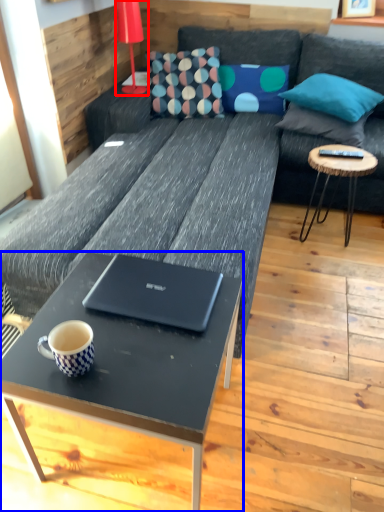
Question: Which object is further to the camera taking this photo, lamp (highlighted by a red box) or coffee table (highlighted by a blue box)?

Choices:
 (A) lamp
 (B) coffee table

Answer: (A)